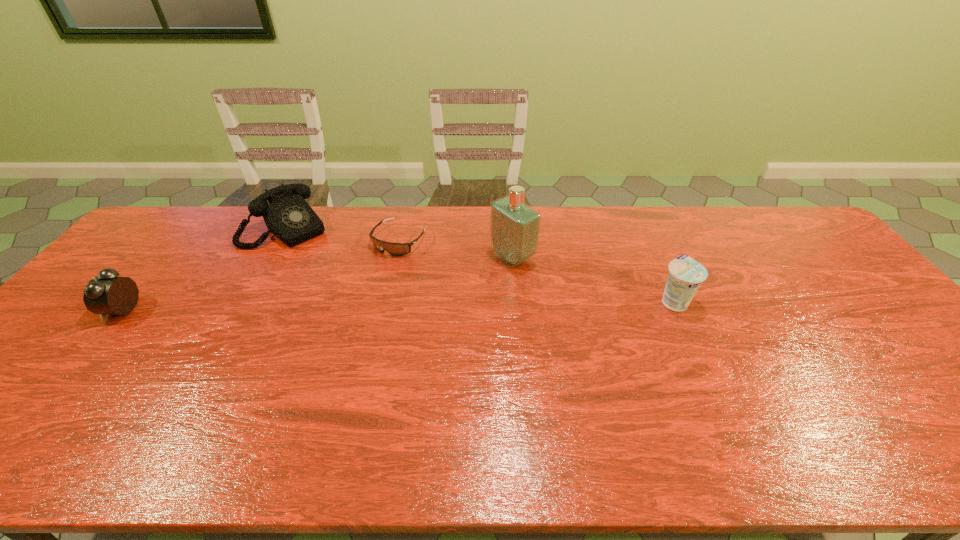
Locate an element on the screen. This screenshot has width=960, height=540. vacant point located 0.310m on the front label of the tallest object is located at coordinates (408, 314).

Where is `free space located 0.160m on the lenses of the goggles`? This screenshot has height=540, width=960. free space located 0.160m on the lenses of the goggles is located at coordinates (357, 289).

Identify the location of vacant space located 0.330m on the lenses of the goggles. (322, 331).

Where is `free point located on the lenses of the goggles`? free point located on the lenses of the goggles is located at coordinates (348, 301).

What are the coordinates of `vacant space positioned 0.220m on the dial of the fourth object from right to left` in the screenshot? It's located at (341, 278).

Image resolution: width=960 pixels, height=540 pixels. Find the location of `free location located 0.280m on the dial of the fourth object from right to left`. free location located 0.280m on the dial of the fourth object from right to left is located at coordinates (350, 288).

Find the location of a particular element. This screenshot has width=960, height=540. vacant space situated 0.190m on the dial of the fourth object from right to left is located at coordinates (336, 273).

You are a GUI agent. You are given a task and a screenshot of the screen. Output one action in this format:
    pyautogui.click(x=<x>, y=<y>)
    Task: Click on the perfume located in the far edge section of the desktop
    This screenshot has height=540, width=960.
    Given the screenshot: What is the action you would take?
    pyautogui.click(x=514, y=230)

Find the location of `goggles present at the far edge`. goggles present at the far edge is located at coordinates (395, 249).

Image resolution: width=960 pixels, height=540 pixels. Identify the location of telephone located at the far edge. (288, 216).